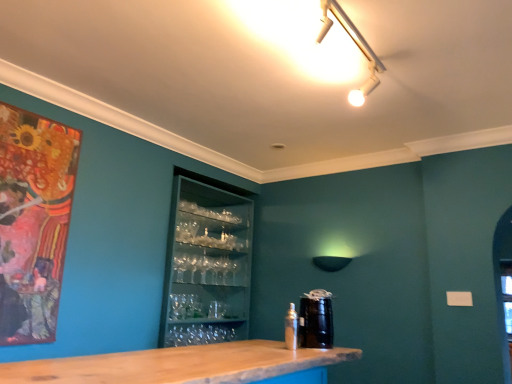
Measure the distance between transparent glassware at center and camera.

A distance of 2.87 meters exists between transparent glassware at center and camera.

Describe the element at coordinates (331, 263) in the screenshot. The image size is (512, 384). I see `matte black lampshade at center` at that location.

In the scene shown: In order to face metallic silver spray can at lower center, should I rotate leftwards or rightwards?

You should rotate right by 5.085 degrees.

Identify the location of transparent glassware at center. (206, 266).

Can you confirm if matte wooden picture frame at left is thinner than metallic silver spray can at lower center?

Yes.

Would you say metallic silver spray can at lower center is part of matte wooden picture frame at left's contents?

No, metallic silver spray can at lower center is located outside of matte wooden picture frame at left.

Is matte wooden picture frame at left looking in the opposite direction of metallic silver spray can at lower center?

No.

From a real-world perspective, is matte wooden picture frame at left positioned over metallic silver spray can at lower center based on gravity?

Correct, in the physical world, matte wooden picture frame at left is higher than metallic silver spray can at lower center.

Is matte wooden picture frame at left positioned behind transparent glassware at center?

No, matte wooden picture frame at left is in front of transparent glassware at center.

Considering the positions of points (62, 275) and (241, 285), is point (62, 275) closer to camera compared to point (241, 285)?

That is True.

Can you confirm if matte wooden picture frame at left is wider than transparent glassware at center?

In fact, matte wooden picture frame at left might be narrower than transparent glassware at center.

What's the angular difference between matte wooden picture frame at left and transparent glassware at center's facing directions?

There is a 0.823-degree angle between the facing directions of matte wooden picture frame at left and transparent glassware at center.

Consider the image. From the image's perspective, would you say metallic silver spray can at lower center is shown under matte black lampshade at center?

Yes, from the image's perspective, metallic silver spray can at lower center is beneath matte black lampshade at center.

Is point (296, 313) less distant than point (348, 261)?

Yes.

Considering the sizes of objects metallic silver spray can at lower center and matte black lampshade at center in the image provided, who is wider, metallic silver spray can at lower center or matte black lampshade at center?

matte black lampshade at center.

Considering the positions of objects metallic silver spray can at lower center and matte black lampshade at center in the image provided, who is behind, metallic silver spray can at lower center or matte black lampshade at center?

matte black lampshade at center.

Can you confirm if transparent glassware at center is positioned to the left of metallic silver spray can at lower center?

Indeed, transparent glassware at center is positioned on the left side of metallic silver spray can at lower center.

From the image's perspective, who appears lower, transparent glassware at center or metallic silver spray can at lower center?

metallic silver spray can at lower center appears lower in the image.

What's the angular difference between transparent glassware at center and metallic silver spray can at lower center's facing directions?

The facing directions of transparent glassware at center and metallic silver spray can at lower center are 0.187 degrees apart.

Is matte wooden picture frame at left positioned in front of matte black lampshade at center?

Yes.

Is matte wooden picture frame at left to the left or to the right of matte black lampshade at center in the image?

In the image, matte wooden picture frame at left appears on the left side of matte black lampshade at center.

How many degrees apart are the facing directions of matte wooden picture frame at left and matte black lampshade at center?

matte wooden picture frame at left and matte black lampshade at center are facing 90.5 degrees away from each other.

Does matte wooden picture frame at left have a greater height compared to matte black lampshade at center?

Yes.

What's the angular difference between black glossy canister at center and matte wooden picture frame at left's facing directions?

The angular difference between black glossy canister at center and matte wooden picture frame at left is 0.637 degrees.

Which is behind, point (306, 334) or point (20, 289)?

The point (306, 334) is farther from the camera.

Which of these two, black glossy canister at center or matte wooden picture frame at left, stands taller?

matte wooden picture frame at left.

From a real-world perspective, is black glossy canister at center physically below matte wooden picture frame at left?

Indeed, from a real-world perspective, black glossy canister at center is positioned beneath matte wooden picture frame at left.

Which is more to the right, matte black lampshade at center or transparent glassware at center?

Positioned to the right is matte black lampshade at center.

Is matte black lampshade at center not within transparent glassware at center?

matte black lampshade at center lies outside transparent glassware at center's area.

Is point (316, 265) positioned after point (211, 187)?

No, (316, 265) is closer to viewer.

At what (x,y) coordinates should I click in order to perform the action: click on picture frame located in front of the metallic silver spray can at lower center. Please return your answer as a coordinate pair (x, y). Looking at the image, I should click on (33, 221).

Locate an element on the screen. drink below the matte wooden picture frame at left (from the image's perspective) is located at coordinates (206, 266).

From the picture: Estimate the real-world distances between objects in this image. Which object is closer to black glossy canister at center, transparent glassware at center or matte black lampshade at center?

matte black lampshade at center.

Estimate the real-world distances between objects in this image. Which object is further from metallic silver spray can at lower center, transparent glassware at center or matte black lampshade at center?

transparent glassware at center is further to metallic silver spray can at lower center.

When comparing their distances from matte black lampshade at center, does black glossy canister at center or matte wooden picture frame at left seem closer?

black glossy canister at center lies closer to matte black lampshade at center than the other object.

Considering their positions, is matte wooden picture frame at left positioned closer to metallic silver spray can at lower center than black glossy canister at center?

Result: Based on the image, black glossy canister at center appears to be nearer to metallic silver spray can at lower center.

When comparing their distances from metallic silver spray can at lower center, does matte black lampshade at center or black glossy canister at center seem further?

The object further to metallic silver spray can at lower center is matte black lampshade at center.

Considering their positions, is matte black lampshade at center positioned closer to matte wooden picture frame at left than transparent glassware at center?

transparent glassware at center is positioned closer to the anchor matte wooden picture frame at left.

When comparing their distances from metallic silver spray can at lower center, does black glossy canister at center or matte wooden picture frame at left seem closer?

Based on the image, black glossy canister at center appears to be nearer to metallic silver spray can at lower center.

From the image, which object appears to be nearer to metallic silver spray can at lower center, matte black lampshade at center or transparent glassware at center?

Based on the image, matte black lampshade at center appears to be nearer to metallic silver spray can at lower center.

You are a GUI agent. You are given a task and a screenshot of the screen. Output one action in this format:
    pyautogui.click(x=<x>, y=<y>)
    Task: Click on the bottle situated between matte wooden picture frame at left and black glossy canister at center from left to right
    This screenshot has width=512, height=384.
    Given the screenshot: What is the action you would take?
    pyautogui.click(x=291, y=328)

Find the location of a particular element. This screenshot has height=384, width=512. bottle between matte wooden picture frame at left and matte black lampshade at center is located at coordinates (291, 328).

What are the coordinates of `drink located between metallic silver spray can at lower center and matte black lampshade at center in the depth direction` in the screenshot? It's located at click(206, 266).

In order to click on beverage between metallic silver spray can at lower center and matte black lampshade at center in the front-back direction in this screenshot , I will do `click(316, 323)`.